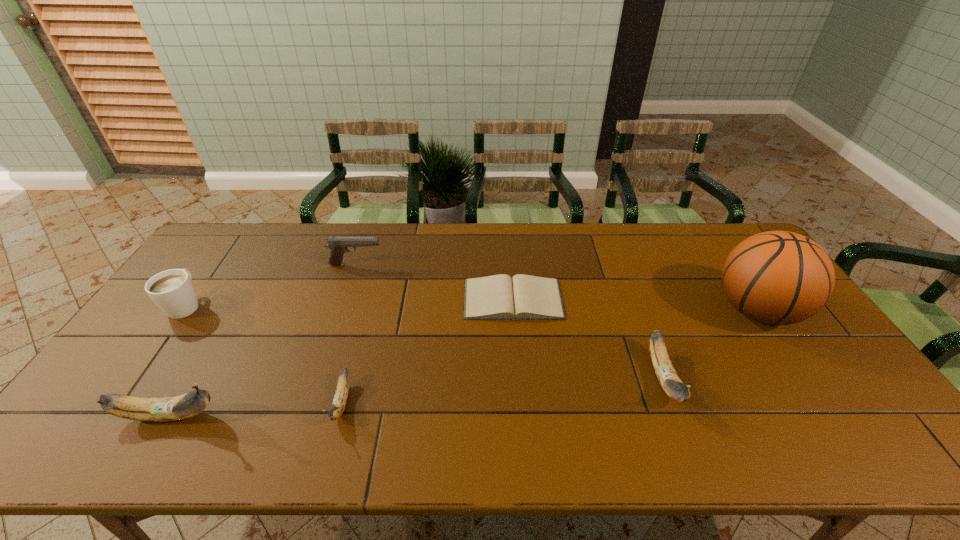
Find the location of a particular element. free space between the leftmost banana and the Bible is located at coordinates (341, 357).

You are a GUI agent. You are given a task and a screenshot of the screen. Output one action in this format:
    pyautogui.click(x=<x>, y=<y>)
    Task: Click on the free spot between the second shortest banana and the Bible
    Image resolution: width=960 pixels, height=540 pixels.
    Given the screenshot: What is the action you would take?
    pyautogui.click(x=588, y=339)

The height and width of the screenshot is (540, 960). Identify the location of free space between the rightmost object and the fifth object from left to right. (636, 305).

This screenshot has height=540, width=960. What are the coordinates of `free spot between the cappuccino and the pistol` in the screenshot? It's located at (271, 285).

At what (x,y) coordinates should I click in order to perform the action: click on vacant area that lies between the pistol and the cappuccino. Please return your answer as a coordinate pair (x, y). Looking at the image, I should click on (271, 285).

You are a GUI agent. You are given a task and a screenshot of the screen. Output one action in this format:
    pyautogui.click(x=<x>, y=<y>)
    Task: Click on the free space between the fifth object from left to right and the tallest object
    
    Given the screenshot: What is the action you would take?
    pyautogui.click(x=636, y=305)

You are a GUI agent. You are given a task and a screenshot of the screen. Output one action in this format:
    pyautogui.click(x=<x>, y=<y>)
    Task: Click on the unoccupied position between the second shortest banana and the second banana from left to right
    
    Given the screenshot: What is the action you would take?
    pyautogui.click(x=503, y=390)

You are a GUI agent. You are given a task and a screenshot of the screen. Output one action in this format:
    pyautogui.click(x=<x>, y=<y>)
    Task: Click on the free spot between the cappuccino and the second banana from left to right
    
    Given the screenshot: What is the action you would take?
    pyautogui.click(x=264, y=354)

Select which object appears as the third closest to the rightmost banana. Please provide its 2D coordinates. Your answer should be formatted as a tuple, i.e. [(x, y)], where the tuple contains the x and y coordinates of a point satisfying the conditions above.

[(340, 398)]

Select which object appears as the fifth closest to the farthest object. Please provide its 2D coordinates. Your answer should be formatted as a tuple, i.e. [(x, y)], where the tuple contains the x and y coordinates of a point satisfying the conditions above.

[(671, 383)]